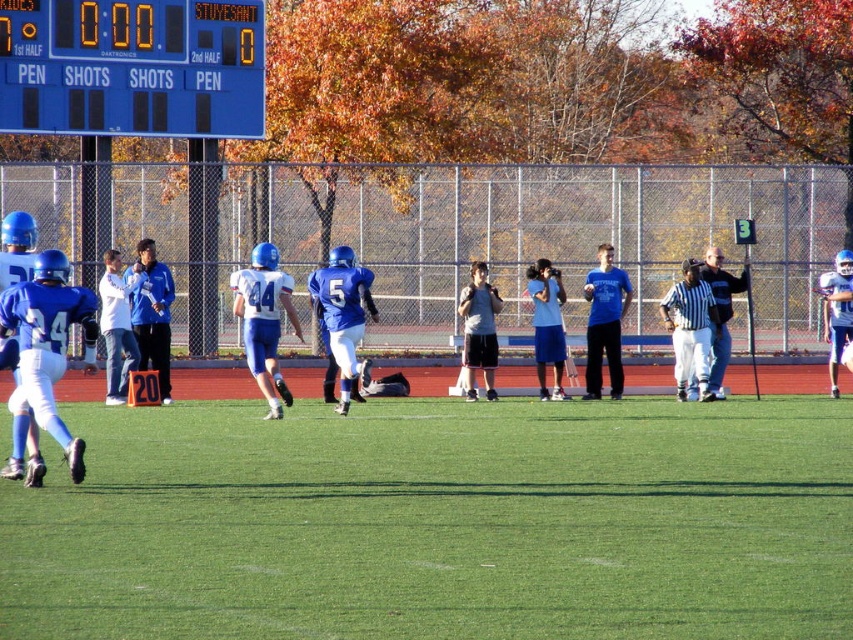
You are a player on the field during the football game. You need to kick the ball to the center of the field. Where should you aim? Please provide coordinates in the format of point coordinates like point (440, 522).

The green grass at center is located at point (440, 522), so you should aim for point (440, 522).

You are a photographer standing at the edge of the field during the football game. You want to take a photo of two specific points on the field marked as point 1 at coordinates (621, 502) and point 2 at coordinates (125, 125). Which point will appear larger in your photo?

Point 1 at coordinates (621, 502) will appear larger in the photo because it is closer to the camera than point 2 at coordinates (125, 125).

You are a player in the football game and you want to avoid slipping. You know that the artificial turf has better grip than the green grass at center. Where should you step to get better grip?

You should step on the artificial turf instead of the green grass at center because the artificial turf provides better grip according to the question.